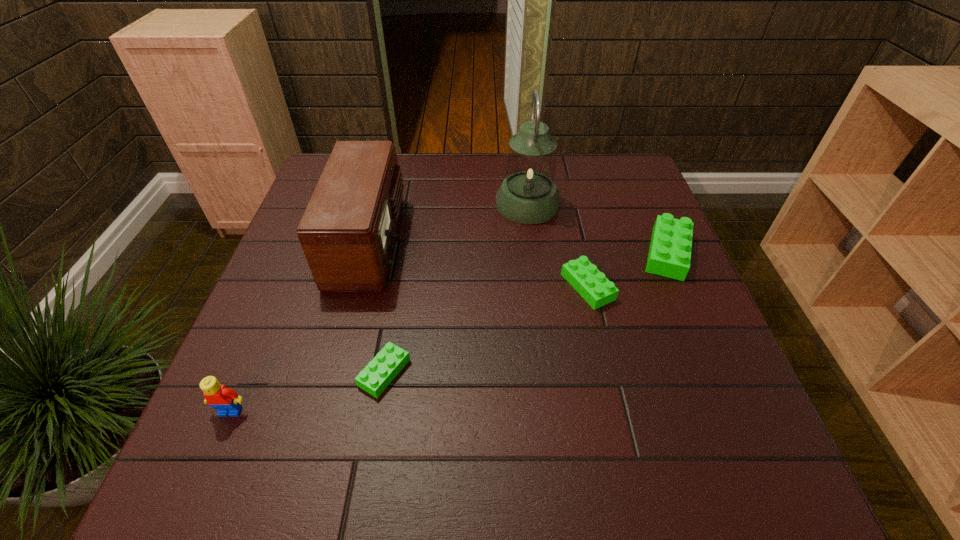
Identify the location of vacant area at the far edge. The height and width of the screenshot is (540, 960). (401, 166).

The height and width of the screenshot is (540, 960). In the image, there is a desktop. In order to click on vacant space at the near edge in this screenshot , I will do `click(659, 423)`.

Where is `vacant region at the left edge of the desktop`? The height and width of the screenshot is (540, 960). vacant region at the left edge of the desktop is located at coordinates (276, 271).

Find the location of a particular element. The image size is (960, 540). vacant space at the near left corner of the desktop is located at coordinates (284, 401).

Identify the location of free space at the far right corner of the desktop. (632, 181).

I want to click on vacant space that's between the second tallest object and the lantern, so click(x=448, y=222).

The image size is (960, 540). In order to click on free space between the third shortest Lego and the third farthest Lego in this screenshot , I will do `click(526, 313)`.

Locate an element on the screen. The image size is (960, 540). unoccupied area between the third Lego from left to right and the radio receiver is located at coordinates (x=479, y=264).

The height and width of the screenshot is (540, 960). I want to click on free area in between the third shortest Lego and the second nearest Lego, so click(x=526, y=313).

Image resolution: width=960 pixels, height=540 pixels. I want to click on vacant point located between the nearest Lego and the third tallest Lego, so click(x=409, y=349).